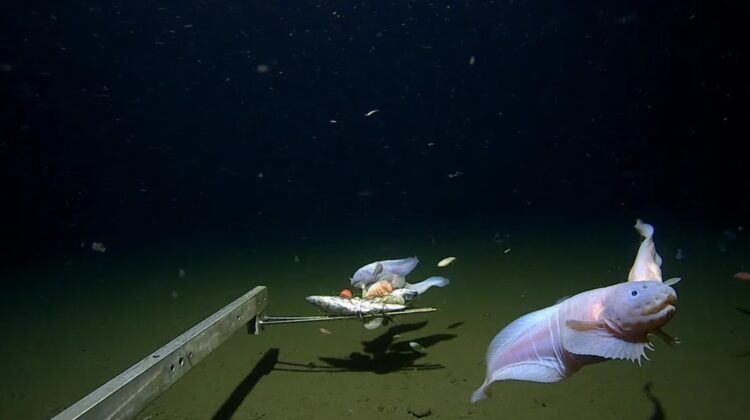
Locate an element on the screen. This screenshot has height=420, width=750. shadows on floor is located at coordinates (658, 411), (375, 361), (333, 367), (441, 339), (394, 334), (268, 363), (255, 382), (232, 406).